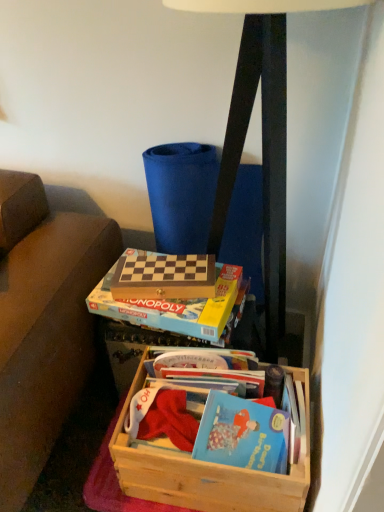
Image resolution: width=384 pixels, height=512 pixels. What are the coordinates of `blank space above wooden board game at center, the 1th paperback book in the back-to-front sequence (from a real-world perspective)` in the screenshot? It's located at (156, 265).